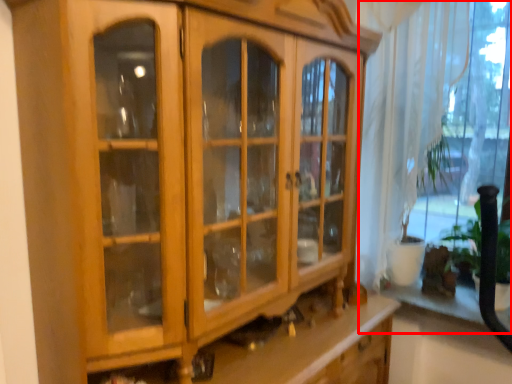
Question: From the image, what is the correct spatial relationship of window (annotated by the red box) in relation to shelf?

Choices:
 (A) right
 (B) left

Answer: (B)